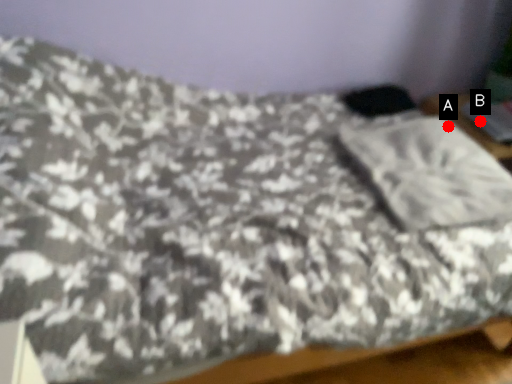
Question: Two points are circled on the image, labeled by A and B beside each circle. Which point appears farthest from the camera in this image?

Choices:
 (A) A is further
 (B) B is further

Answer: (B)